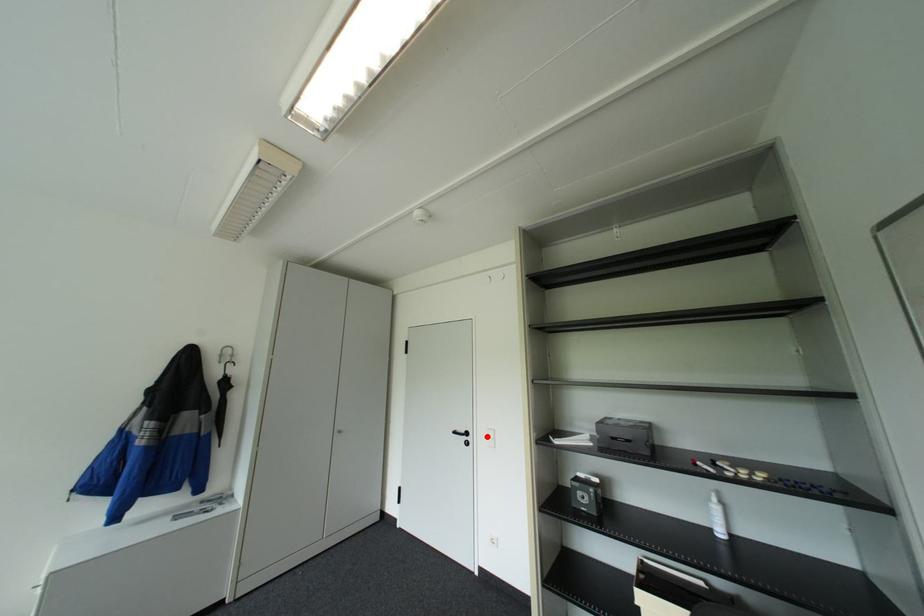
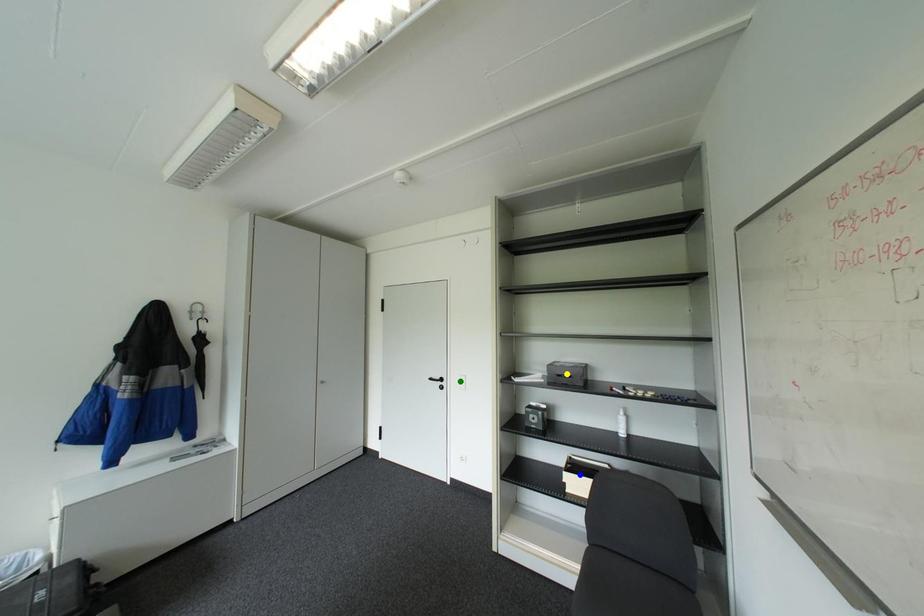
Question: I am providing you with two images of the same scene from different viewpoints. A red point is marked on the first image. You are given multiple points on the second image. Can you choose the point in image 2 that corresponds to the point in image 1?

Choices:
 (A) blue point
 (B) yellow point
 (C) green point

Answer: (C)